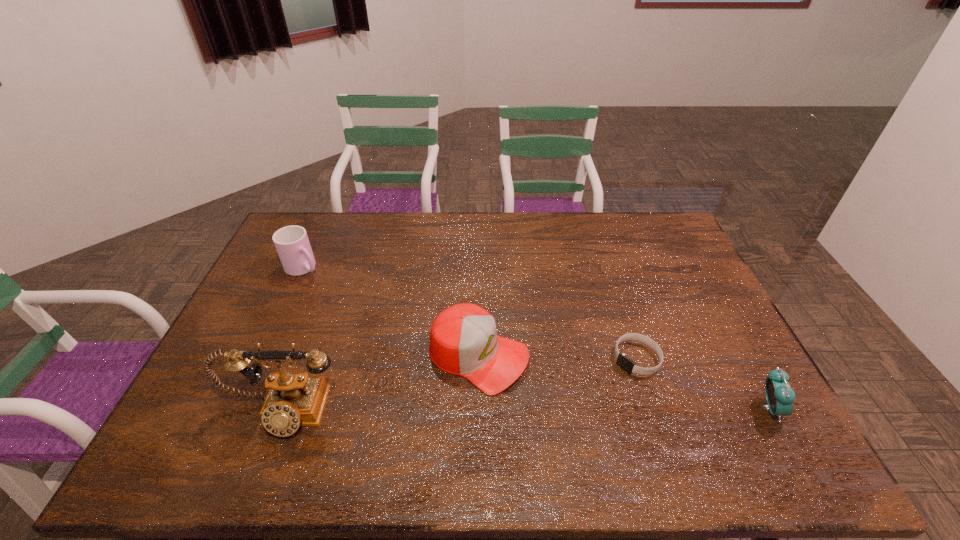
Locate an element on the screen. The height and width of the screenshot is (540, 960). object that is positioned at the right edge is located at coordinates (780, 397).

Where is `object at the near left corner`? This screenshot has height=540, width=960. object at the near left corner is located at coordinates (295, 399).

Identify the location of object situated at the near right corner. The width and height of the screenshot is (960, 540). (780, 397).

Where is `blank space at the far edge of the desktop`? The width and height of the screenshot is (960, 540). blank space at the far edge of the desktop is located at coordinates (509, 242).

You are a GUI agent. You are given a task and a screenshot of the screen. Output one action in this format:
    pyautogui.click(x=<x>, y=<y>)
    Task: Click on the free space at the near edge
    
    Given the screenshot: What is the action you would take?
    pyautogui.click(x=521, y=400)

Locate an element on the screen. free space at the left edge of the desktop is located at coordinates (268, 284).

The height and width of the screenshot is (540, 960). I want to click on blank space at the right edge of the desktop, so click(708, 309).

Find the location of `vacant space at the far left corner of the desktop`. vacant space at the far left corner of the desktop is located at coordinates (321, 252).

This screenshot has height=540, width=960. I want to click on blank area at the far right corner, so click(x=655, y=227).

You are a GUI agent. You are given a task and a screenshot of the screen. Output one action in this format:
    pyautogui.click(x=<x>, y=<y>)
    Task: Click on the unoccupied position between the rightmost object and the third object from right to left
    This screenshot has height=540, width=960.
    Given the screenshot: What is the action you would take?
    pyautogui.click(x=623, y=382)